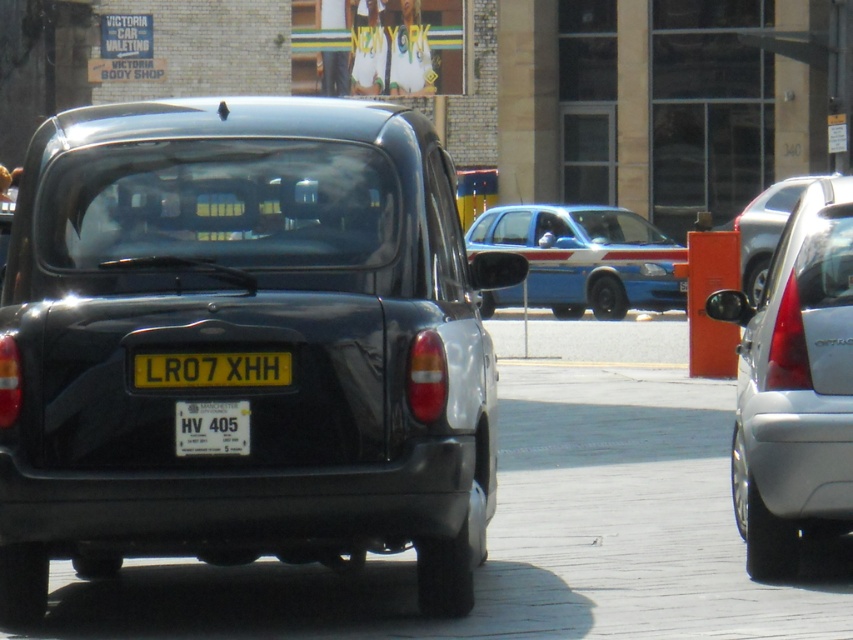
Question: Does matte black car at center come behind blue glossy car at center?

Choices:
 (A) no
 (B) yes

Answer: (A)

Question: Can you confirm if matte black car at center is smaller than satin silver sedan at right?

Choices:
 (A) yes
 (B) no

Answer: (B)

Question: Is satin silver sedan at right below shiny silver car at right?

Choices:
 (A) no
 (B) yes

Answer: (B)

Question: Which point appears closest to the camera in this image?

Choices:
 (A) 200,438
 (B) 808,179

Answer: (A)

Question: Which point appears closest to the camera in this image?

Choices:
 (A) (242, 161)
 (B) (550, 289)
 (C) (181, 445)

Answer: (C)

Question: Which point appears farthest from the camera in this image?

Choices:
 (A) (236, 362)
 (B) (656, 259)

Answer: (B)